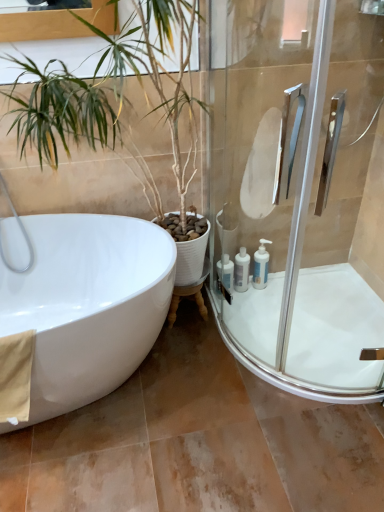
Locate an element on the screen. This screenshot has width=384, height=512. vacant space to the right of white glossy bathtub at left is located at coordinates (241, 417).